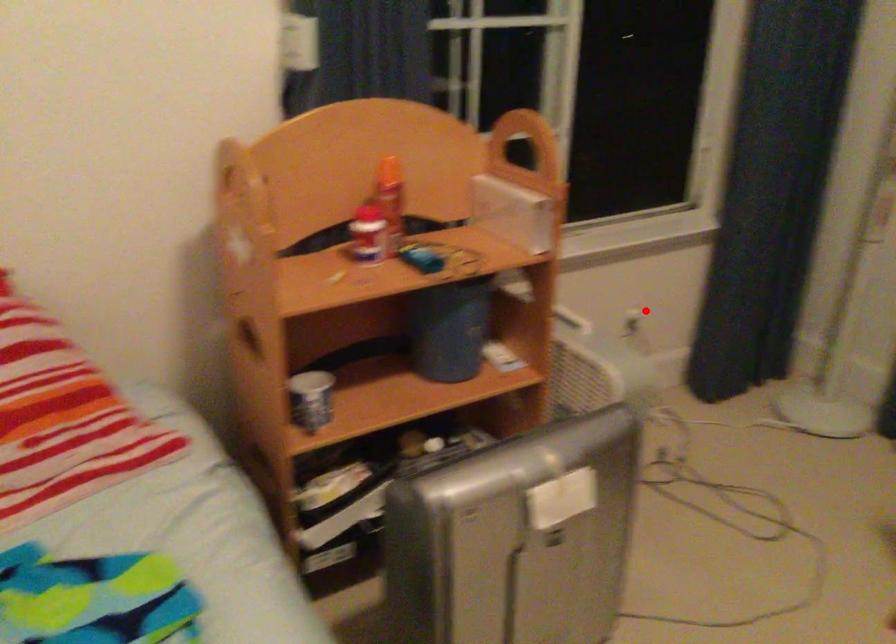
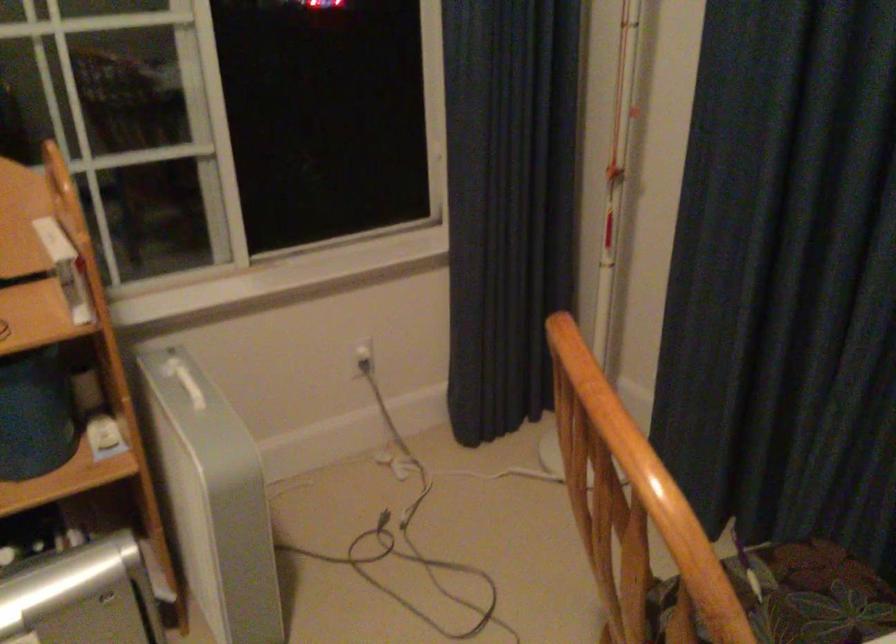
Question: I am providing you with two images of the same scene from different viewpoints. Image1 has a red point marked. In image2, the corresponding 3D location appears at what relative position? Reply with the corresponding letter.

Choices:
 (A) Closer
 (B) Farther

Answer: (A)